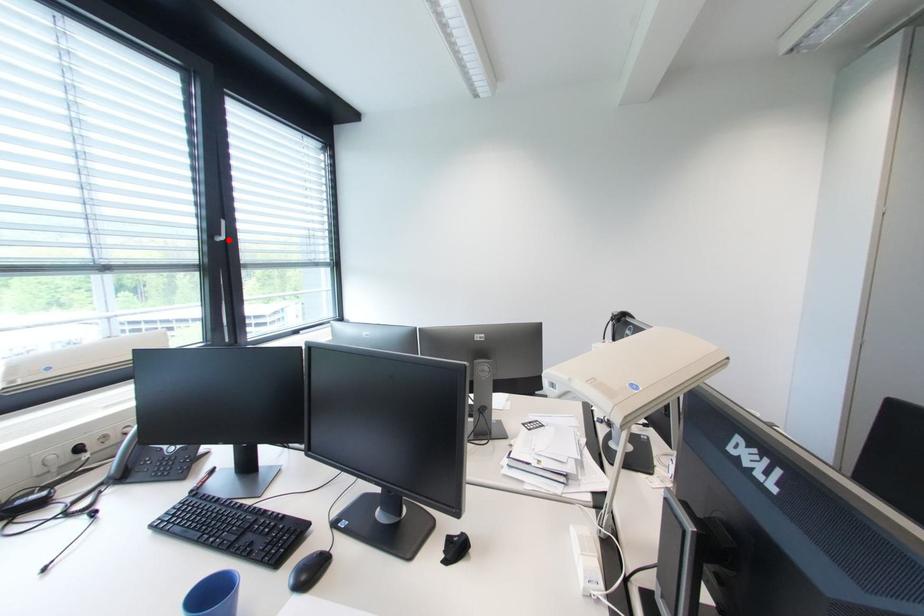
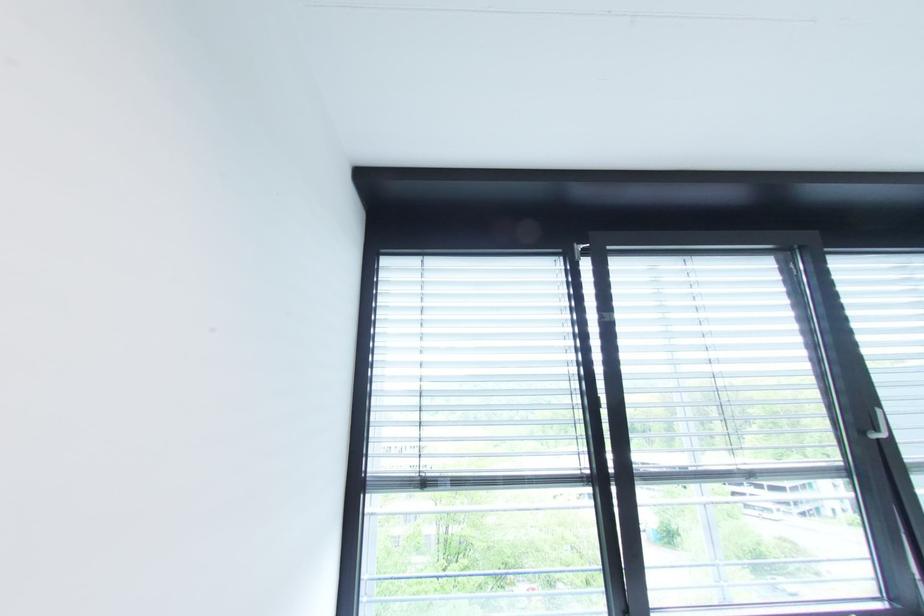
Question: I am providing you with two images of the same scene from different viewpoints. In image1, a red point is highlighted. Considering the same 3D point in image2, which of the following is correct?

Choices:
 (A) It is closer
 (B) It is farther

Answer: (A)